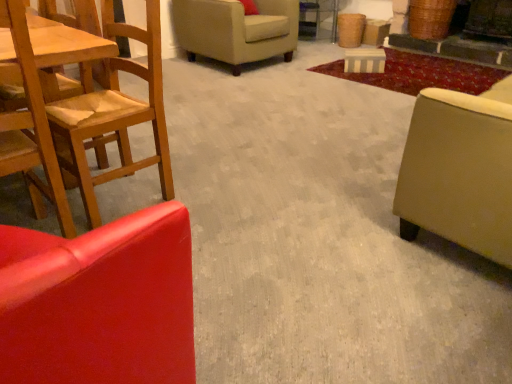
Question: Considering the positions of beige fabric studio couch at right and wooden chair at left, marked as the 1th chair in a front-to-back arrangement, in the image, is beige fabric studio couch at right taller or shorter than wooden chair at left, marked as the 1th chair in a front-to-back arrangement,?

Choices:
 (A) short
 (B) tall

Answer: (A)

Question: From the image's perspective, relative to wooden chair at left, marked as the 1th chair in a front-to-back arrangement, is beige fabric studio couch at right above or below?

Choices:
 (A) above
 (B) below

Answer: (A)

Question: Which object is positioned closest to the wooden chair at left, the 2th chair positioned from the back?

Choices:
 (A) beige fabric studio couch at right
 (B) beige fabric armchair at upper center, the third chair viewed from the front
 (C) wooden chair at left, the third chair positioned from the back

Answer: (C)

Question: Which of these objects is positioned closest to the wooden chair at left, the third chair positioned from the back?

Choices:
 (A) wooden chair at left, the second chair positioned from the front
 (B) beige fabric studio couch at right
 (C) beige fabric armchair at upper center, which appears as the 1th chair when viewed from the back

Answer: (A)